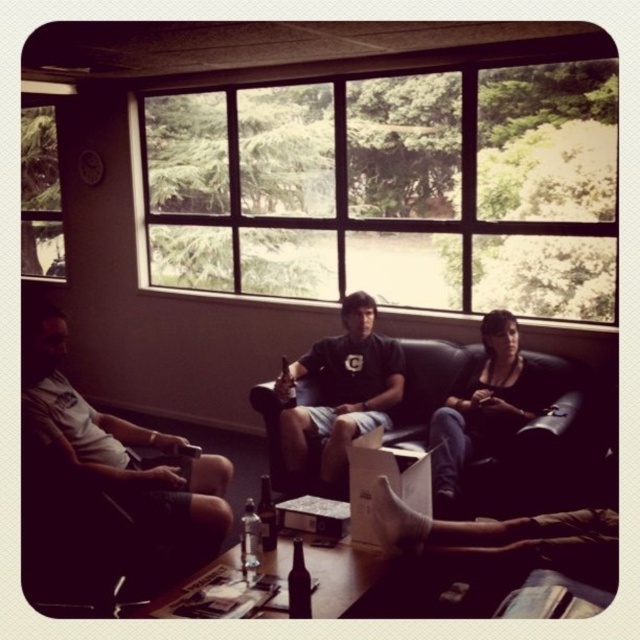
Question: Is matte black shirt at center wider than clear glass bottle at center?

Choices:
 (A) no
 (B) yes

Answer: (B)

Question: Which of the following is the farthest from the observer?

Choices:
 (A) clear glass window at upper center
 (B) transparent glass window at upper left
 (C) clear glass bottle at center

Answer: (B)

Question: Which object is the closest to the matte white shorts at left?

Choices:
 (A) black leather couch at center
 (B) brown glass bottle at center

Answer: (B)

Question: Is transparent glass window at upper left below clear glass bottle at center?

Choices:
 (A) yes
 (B) no

Answer: (B)

Question: Is black leather couch at center smaller than brown glass bottle at center?

Choices:
 (A) no
 (B) yes

Answer: (A)

Question: Which object is closer to the camera taking this photo?

Choices:
 (A) matte white shorts at left
 (B) brown glass bottle at center
 (C) matte black shirt at center

Answer: (B)